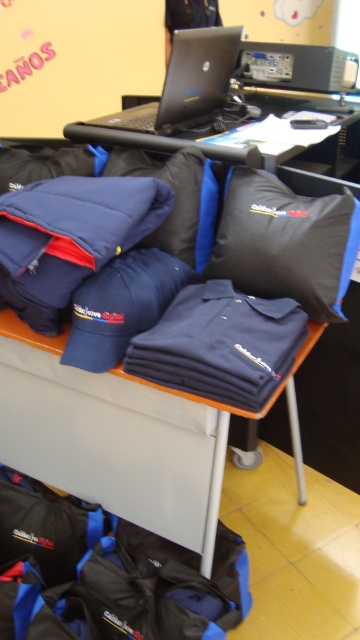
Who is higher up, black fabric bag at lower left or black glossy laptop at upper center?

black glossy laptop at upper center is higher up.

Between point (34, 636) and point (191, 125), which one is positioned in front?

Positioned in front is point (34, 636).

Measure the distance between black fabric bag at lower left and camera.

black fabric bag at lower left and camera are 1.08 meters apart.

You are a GUI agent. You are given a task and a screenshot of the screen. Output one action in this format:
    pyautogui.click(x=<x>, y=<y>)
    Task: Click on the black fabric bag at lower left
    This screenshot has height=640, width=360.
    Given the screenshot: What is the action you would take?
    pyautogui.click(x=106, y=573)

Can you confirm if navy blue fabric shirt at center is shorter than black fabric bag at lower left?

In fact, navy blue fabric shirt at center may be taller than black fabric bag at lower left.

Who is taller, navy blue fabric shirt at center or black fabric bag at lower left?

With more height is navy blue fabric shirt at center.

Which is behind, point (136, 388) or point (78, 540)?

The point (78, 540) is behind.

Where is `navy blue fabric shirt at center`? The height and width of the screenshot is (640, 360). navy blue fabric shirt at center is located at coordinates tap(122, 436).

Is black fabric bag at lower left further to camera compared to black matte laptop at upper center?

No, black fabric bag at lower left is closer to the viewer.

Who is more forward, (217, 584) or (303, 145)?

Point (217, 584) is more forward.

Which is in front, point (135, 561) or point (344, 106)?

Point (135, 561) is more forward.

You are a GUI agent. You are given a task and a screenshot of the screen. Output one action in this format:
    pyautogui.click(x=<x>, y=<y>)
    Task: Click on the black fabric bag at lower left
    This screenshot has width=360, height=640.
    Given the screenshot: What is the action you would take?
    pyautogui.click(x=106, y=573)